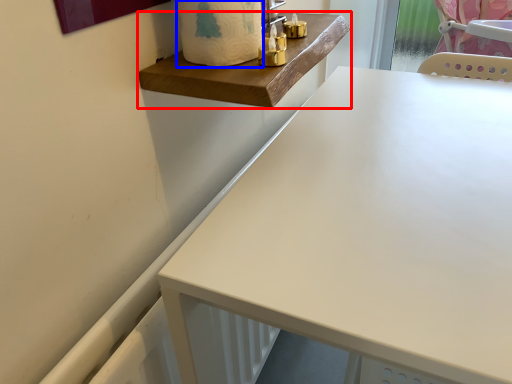
Question: Which of the following is the farthest to the observer, changing table (highlighted by a red box) or toilet paper (highlighted by a blue box)?

Choices:
 (A) changing table
 (B) toilet paper

Answer: (A)